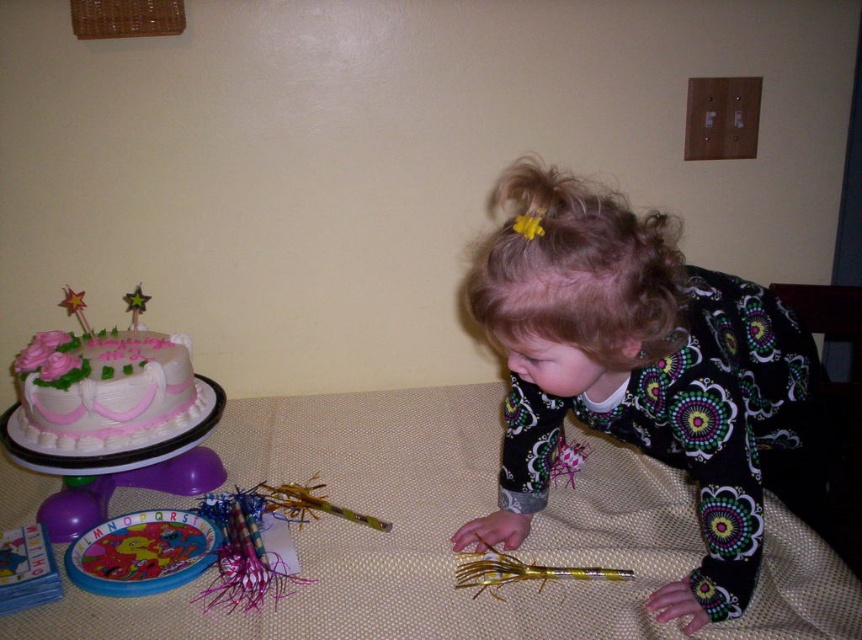
You are a child who wants to blow out the candles on the pink frosted cake at left. Considering the height of the beige fabric table at lower center, will you need to stand on it to reach the cake?

The beige fabric table at lower center is taller than the pink frosted cake at left, so you would need to stand on the table to reach the cake.

From the picture: You are a photographer standing at the camera position. You want to take a closeup photo of the birthday cake. There is a point at coordinates point (209, 634) that is 38.05 inches away from you. Is this point the right distance for a clear closeup?

The point at coordinates point (209, 634) is 38.05 inches away from the camera. This distance may be too far for a clear closeup photo of the birthday cake, as closeups typically require being within 12 to 24 inches of the subject.